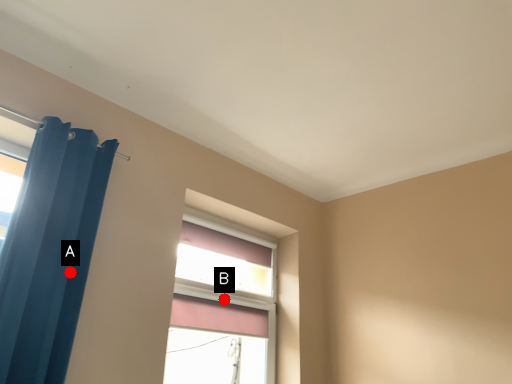
Question: Two points are circled on the image, labeled by A and B beside each circle. Which point is closer to the camera?

Choices:
 (A) A is closer
 (B) B is closer

Answer: (A)